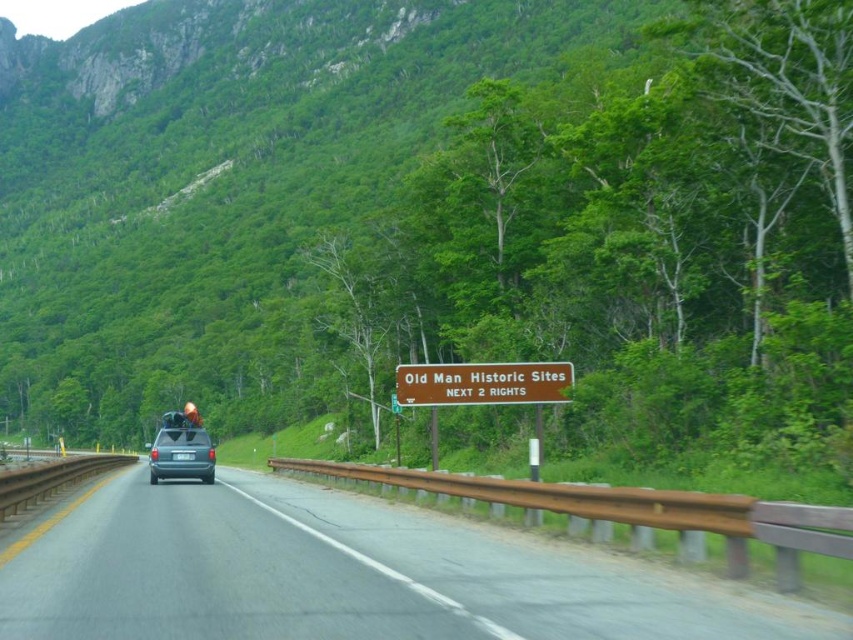
You are driving a matte gray van at center and see a brown wooden sign at center ahead. To avoid hitting the sign, should you steer left or right?

The brown wooden sign at center is positioned on the right side of matte gray van at center, so to avoid hitting it, you should steer left.

You are a driver approaching the brown sign and need to know which direction to turn. The sign has two arrows pointing to different directions. The first arrow points to point 1 at point (645, 609) and the second arrow points to point 2 at point (200, 465). Since you want to take the closest turn, which point should you follow?

Point 1 at point (645, 609) is closer to the camera than point (200, 465), so you should follow the arrow pointing to point 1 at point (645, 609) to take the closest turn.